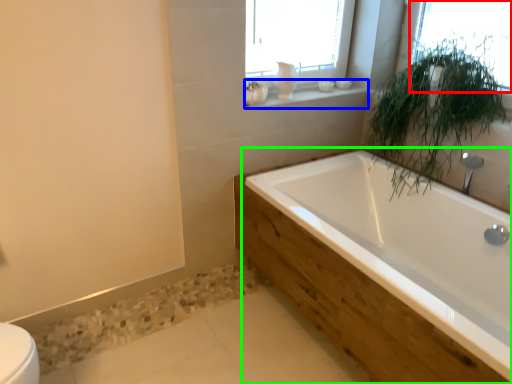
Question: Estimate the real-world distances between objects in this image. Which object is farther from window (highlighted by a red box), window sill (highlighted by a blue box) or bathtub (highlighted by a green box)?

Choices:
 (A) window sill
 (B) bathtub

Answer: (B)